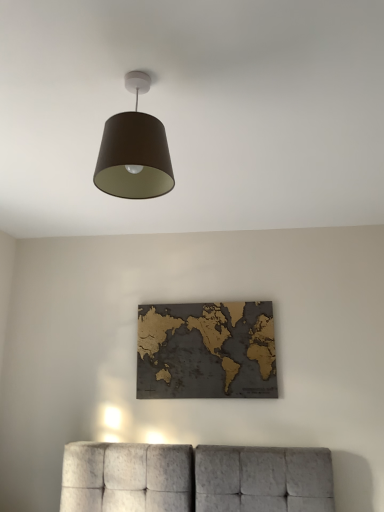
This screenshot has width=384, height=512. What are the coordinates of `free space above matte brown shade at upper center (from a real-world perspective)` in the screenshot? It's located at (139, 81).